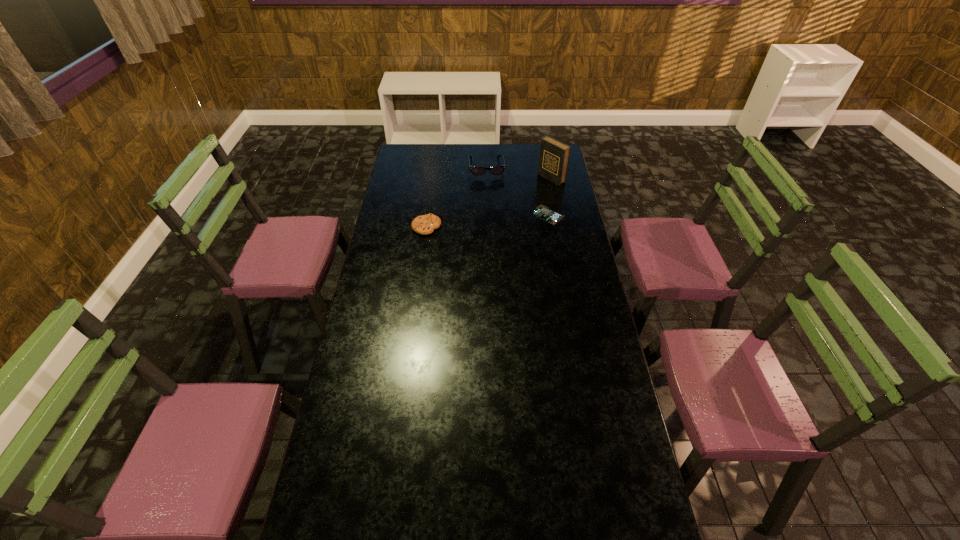
You are a GUI agent. You are given a task and a screenshot of the screen. Output one action in this format:
    pyautogui.click(x=<x>, y=<y>)
    Task: Click on the leftmost object
    The image size is (960, 540).
    Given the screenshot: What is the action you would take?
    425,224

Locate an element on the screen. The height and width of the screenshot is (540, 960). cookie is located at coordinates (425, 224).

The height and width of the screenshot is (540, 960). In order to click on the shortest object in this screenshot , I will do `click(543, 212)`.

Image resolution: width=960 pixels, height=540 pixels. In order to click on diary in this screenshot , I will do `click(554, 156)`.

Locate an element on the screen. This screenshot has height=540, width=960. the third object from right to left is located at coordinates (496, 170).

Locate an element on the screen. the third shortest object is located at coordinates (496, 170).

Identify the location of free space located on the left of the third tallest object. tap(392, 227).

Locate an element on the screen. The width and height of the screenshot is (960, 540). vacant position located 0.080m on the left of the shortest object is located at coordinates (516, 215).

Identify the location of free region located on the front cover of the tallest object. (518, 198).

Where is `free region located 0.330m on the front cover of the tallest object`? free region located 0.330m on the front cover of the tallest object is located at coordinates (496, 211).